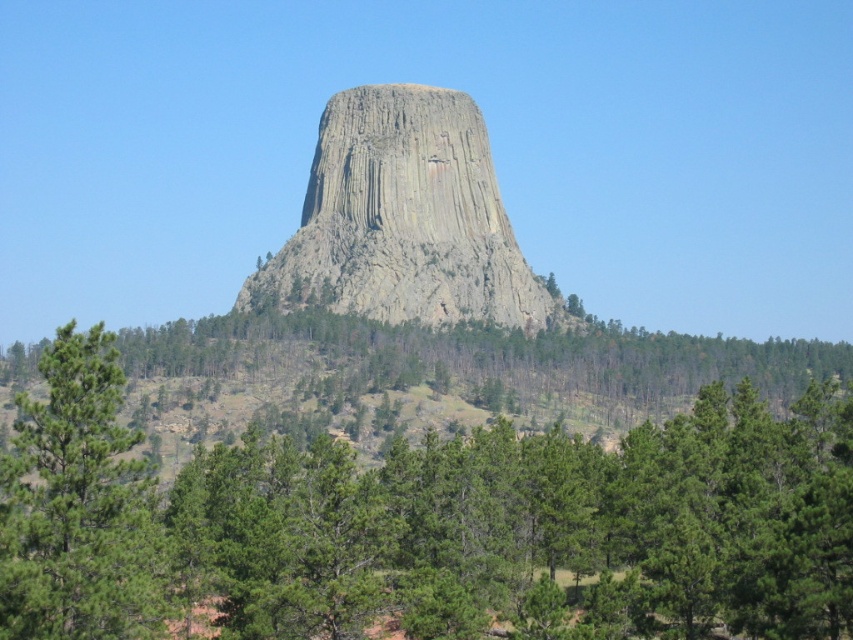
From the picture: Does green leafy tree at center have a smaller size compared to gray rock formation at center?

No, green leafy tree at center is not smaller than gray rock formation at center.

At what (x,y) coordinates should I click in order to perform the action: click on green leafy tree at center. Please return your answer as a coordinate pair (x, y). Image resolution: width=853 pixels, height=640 pixels. Looking at the image, I should click on (427, 524).

Is point (19, 552) positioned after point (364, 284)?

No, (19, 552) is closer to viewer.

Find the location of a particular element. This screenshot has width=853, height=640. green leafy tree at center is located at coordinates (427, 524).

Is gray rock formation at center behind green matte tree at lower left?

Yes, gray rock formation at center is further from the viewer.

Does gray rock formation at center appear under green matte tree at lower left?

No.

This screenshot has height=640, width=853. What are the coordinates of `gray rock formation at center` in the screenshot? It's located at (402, 218).

Is green leafy tree at center positioned before green matte tree at lower left?

No.

Does point (306, 572) lie in front of point (32, 628)?

No, it is behind (32, 628).

Which is behind, point (45, 432) or point (115, 602)?

Point (45, 432)

This screenshot has width=853, height=640. Identify the location of green leafy tree at center. (427, 524).